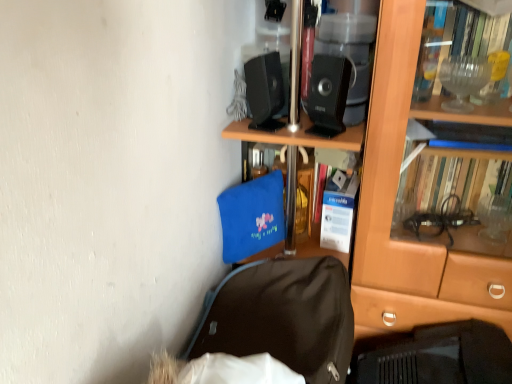
Question: Is black matte laptop at lower right not within brown wooden bookcase at center?

Choices:
 (A) yes
 (B) no

Answer: (A)

Question: Can you confirm if black matte laptop at lower right is bigger than brown wooden bookcase at center?

Choices:
 (A) no
 (B) yes

Answer: (A)

Question: Can you confirm if black matte laptop at lower right is smaller than brown wooden bookcase at center?

Choices:
 (A) no
 (B) yes

Answer: (B)

Question: Is black matte laptop at lower right wider than brown wooden bookcase at center?

Choices:
 (A) yes
 (B) no

Answer: (B)

Question: Is brown wooden bookcase at center surrounded by black matte laptop at lower right?

Choices:
 (A) yes
 (B) no

Answer: (B)

Question: Looking at their shapes, would you say black plastic speaker at upper center, positioned as the 2th loudspeaker in right-to-left order, is wider or thinner than black matte laptop at lower right?

Choices:
 (A) thin
 (B) wide

Answer: (A)

Question: Choose the correct answer: Is black plastic speaker at upper center, which ranks as the 1th loudspeaker in left-to-right order, inside black matte laptop at lower right or outside it?

Choices:
 (A) outside
 (B) inside

Answer: (A)

Question: Considering the positions of point (x=272, y=54) and point (x=434, y=382), is point (x=272, y=54) closer or farther from the camera than point (x=434, y=382)?

Choices:
 (A) closer
 (B) farther

Answer: (B)

Question: Relative to black matte laptop at lower right, is black plastic speaker at upper center, positioned as the 2th loudspeaker in right-to-left order, in front or behind?

Choices:
 (A) behind
 (B) front

Answer: (A)

Question: From the image's perspective, relative to blue fabric bag at center, is brown wooden bookcase at center above or below?

Choices:
 (A) above
 (B) below

Answer: (A)

Question: Is brown wooden bookcase at center taller or shorter than blue fabric bag at center?

Choices:
 (A) short
 (B) tall

Answer: (B)

Question: Looking at their shapes, would you say brown wooden bookcase at center is wider or thinner than blue fabric bag at center?

Choices:
 (A) thin
 (B) wide

Answer: (B)

Question: Is brown wooden bookcase at center in front of or behind blue fabric bag at center in the image?

Choices:
 (A) front
 (B) behind

Answer: (A)

Question: Does point (314, 119) appear closer or farther from the camera than point (263, 347)?

Choices:
 (A) closer
 (B) farther

Answer: (B)

Question: From a real-world perspective, is black plastic speaker at upper center, marked as the 2th loudspeaker in a left-to-right arrangement, above or below black fabric backpack at lower center?

Choices:
 (A) above
 (B) below

Answer: (A)